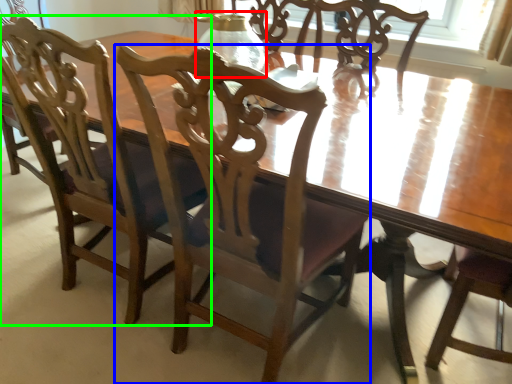
Question: Which is farther away from glass vase (highlighted by a red box)? chair (highlighted by a blue box) or chair (highlighted by a green box)?

Choices:
 (A) chair
 (B) chair

Answer: (B)